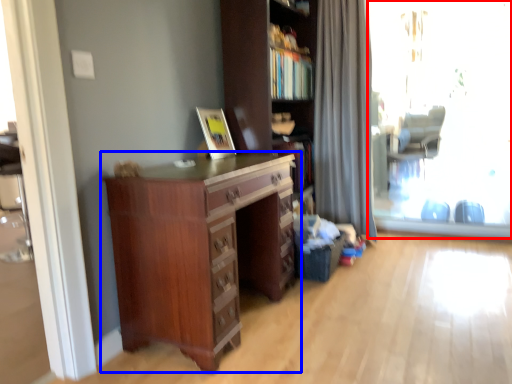
Question: Which object appears farthest to the camera in this image, window screen (highlighted by a red box) or chest of drawers (highlighted by a blue box)?

Choices:
 (A) window screen
 (B) chest of drawers

Answer: (A)